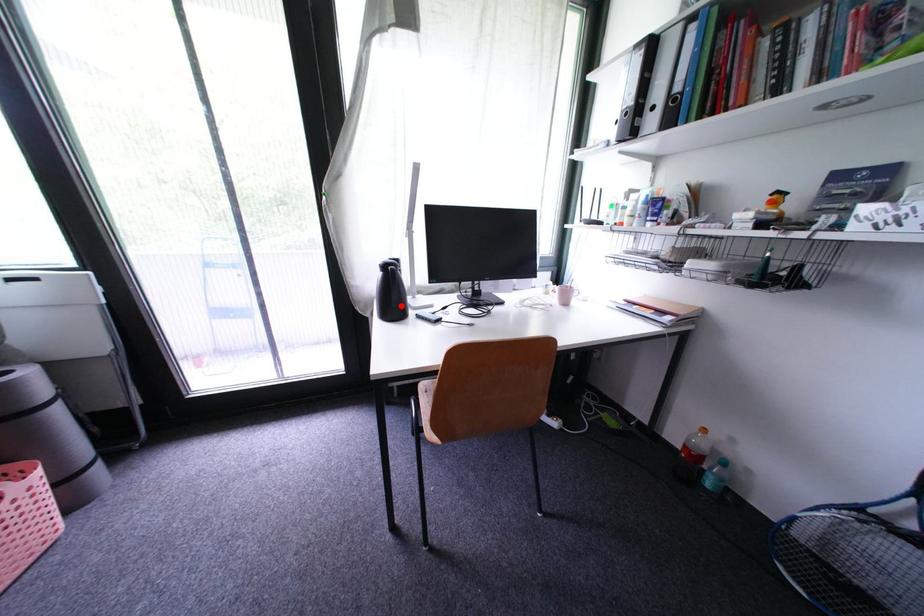
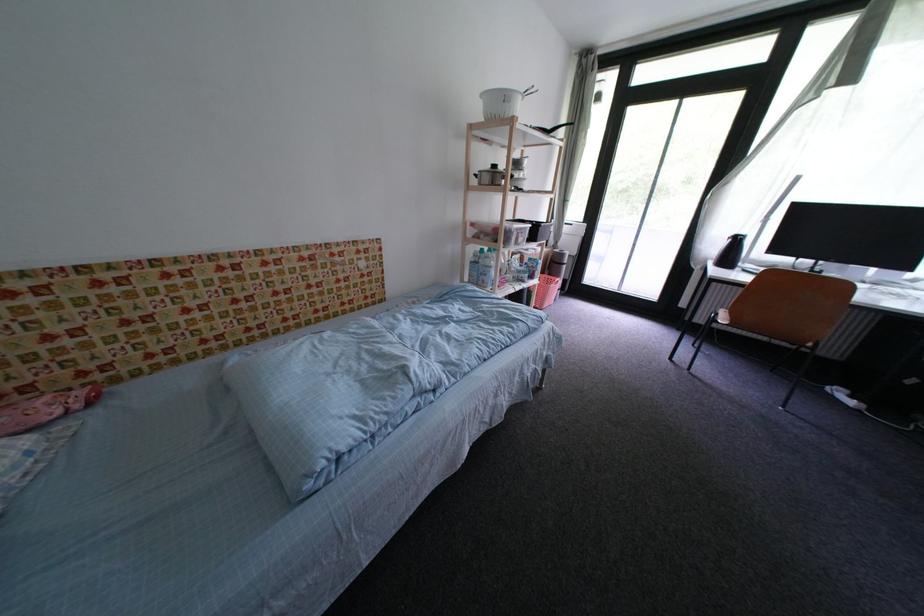
The point at the highlighted location is marked in the first image. Where is the corresponding point in the second image?

(736, 261)